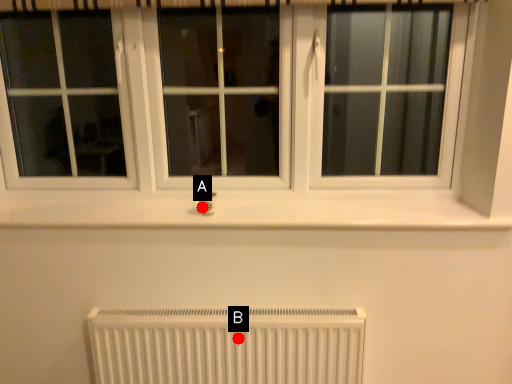
Question: Two points are circled on the image, labeled by A and B beside each circle. Which point is closer to the camera taking this photo?

Choices:
 (A) A is closer
 (B) B is closer

Answer: (B)